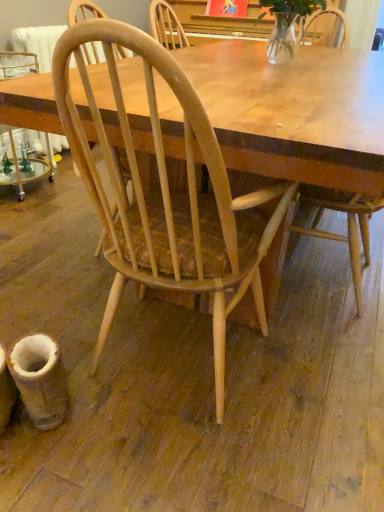
Find the location of a particular element. clear glass vase at upper center is located at coordinates (287, 24).

Describe the element at coordinates (347, 225) in the screenshot. The image size is (384, 512). I see `light wood chair at center, marked as the 2th chair in a left-to-right arrangement` at that location.

This screenshot has height=512, width=384. Identify the location of natural wood chair at center, which is the second chair from right to left. (167, 195).

Is natural wood chair at center, which is the second chair from right to left, thinner than clear glass vase at upper center?

In fact, natural wood chair at center, which is the second chair from right to left, might be wider than clear glass vase at upper center.

Looking at this image, which is nearer, (x=139, y=47) or (x=304, y=1)?

The point (x=139, y=47) is more forward.

Considering the relative sizes of natural wood chair at center, which is the second chair from right to left, and clear glass vase at upper center in the image provided, is natural wood chair at center, which is the second chair from right to left, shorter than clear glass vase at upper center?

No, natural wood chair at center, which is the second chair from right to left, is not shorter than clear glass vase at upper center.

From the image's perspective, which one is positioned higher, natural wood chair at center, acting as the 1th chair starting from the left, or clear glass vase at upper center?

clear glass vase at upper center, from the image's perspective.

Is point (253, 195) closer to viewer compared to point (314, 18)?

Yes, it is in front of point (314, 18).

Which object is more forward, natural wood chair at center, acting as the 1th chair starting from the left, or light wood chair at center, the first chair from the right?

Positioned in front is natural wood chair at center, acting as the 1th chair starting from the left.

From the image's perspective, which one is positioned higher, natural wood chair at center, which is the second chair from right to left, or light wood chair at center, the first chair from the right?

light wood chair at center, the first chair from the right, is shown above in the image.

How different are the orientations of natural wood chair at center, acting as the 1th chair starting from the left, and light wood chair at center, marked as the 2th chair in a left-to-right arrangement, in degrees?

natural wood chair at center, acting as the 1th chair starting from the left, and light wood chair at center, marked as the 2th chair in a left-to-right arrangement, are facing 90 degrees away from each other.

Consider the image. From a real-world perspective, is light wood chair at center, marked as the 2th chair in a left-to-right arrangement, located beneath clear glass vase at upper center?

Correct, in the physical world, light wood chair at center, marked as the 2th chair in a left-to-right arrangement, is lower than clear glass vase at upper center.

Can you tell me how much light wood chair at center, the first chair from the right, and clear glass vase at upper center differ in facing direction?

The facing directions of light wood chair at center, the first chair from the right, and clear glass vase at upper center are 91.4 degrees apart.

From the image's perspective, which is below, light wood chair at center, marked as the 2th chair in a left-to-right arrangement, or clear glass vase at upper center?

From the image's view, light wood chair at center, marked as the 2th chair in a left-to-right arrangement, is below.

Is clear glass vase at upper center at the left side of natural wood chair at center, acting as the 1th chair starting from the left?

No.

Would you say clear glass vase at upper center is a long distance from natural wood chair at center, which is the second chair from right to left?

They are positioned close to each other.

Considering the sizes of objects clear glass vase at upper center and natural wood chair at center, acting as the 1th chair starting from the left, in the image provided, who is bigger, clear glass vase at upper center or natural wood chair at center, acting as the 1th chair starting from the left,?

With larger size is natural wood chair at center, acting as the 1th chair starting from the left.

Could you measure the distance between clear glass vase at upper center and natural wood chair at center, which is the second chair from right to left?

clear glass vase at upper center and natural wood chair at center, which is the second chair from right to left, are 37.80 inches apart.

Is clear glass vase at upper center outside of light wood chair at center, marked as the 2th chair in a left-to-right arrangement?

Absolutely, clear glass vase at upper center is external to light wood chair at center, marked as the 2th chair in a left-to-right arrangement.

In order to click on the 1st chair located beneath the clear glass vase at upper center (from a real-world perspective) in this screenshot , I will do `click(347, 225)`.

In the image, is clear glass vase at upper center on the left side or the right side of light wood chair at center, the first chair from the right?

clear glass vase at upper center is to the left of light wood chair at center, the first chair from the right.

Which object is wider, clear glass vase at upper center or light wood chair at center, marked as the 2th chair in a left-to-right arrangement?

light wood chair at center, marked as the 2th chair in a left-to-right arrangement.

Who is bigger, light wood chair at center, the first chair from the right, or natural wood chair at center, which is the second chair from right to left?

natural wood chair at center, which is the second chair from right to left.

Considering the positions of objects light wood chair at center, the first chair from the right, and natural wood chair at center, acting as the 1th chair starting from the left, in the image provided, who is more to the left, light wood chair at center, the first chair from the right, or natural wood chair at center, acting as the 1th chair starting from the left,?

natural wood chair at center, acting as the 1th chair starting from the left.

Can you confirm if light wood chair at center, the first chair from the right, is wider than natural wood chair at center, acting as the 1th chair starting from the left?

No, light wood chair at center, the first chair from the right, is not wider than natural wood chair at center, acting as the 1th chair starting from the left.

Is light wood chair at center, marked as the 2th chair in a left-to-right arrangement, facing away from natural wood chair at center, which is the second chair from right to left?

light wood chair at center, marked as the 2th chair in a left-to-right arrangement, does not have its back to natural wood chair at center, which is the second chair from right to left.

The image size is (384, 512). Find the location of `plant above the natural wood chair at center, which is the second chair from right to left (from the image's perspective)`. plant above the natural wood chair at center, which is the second chair from right to left (from the image's perspective) is located at coordinates (287, 24).

The height and width of the screenshot is (512, 384). Identify the location of chair located on the left of light wood chair at center, the first chair from the right. (167, 195).

Looking at the image, which one is located closer to light wood chair at center, the first chair from the right, natural wood chair at center, which is the second chair from right to left, or clear glass vase at upper center?

natural wood chair at center, which is the second chair from right to left, is positioned closer to the anchor light wood chair at center, the first chair from the right.

Estimate the real-world distances between objects in this image. Which object is closer to natural wood chair at center, acting as the 1th chair starting from the left, clear glass vase at upper center or light wood chair at center, marked as the 2th chair in a left-to-right arrangement?

light wood chair at center, marked as the 2th chair in a left-to-right arrangement, lies closer to natural wood chair at center, acting as the 1th chair starting from the left, than the other object.

Looking at the image, which one is located further to natural wood chair at center, which is the second chair from right to left, light wood chair at center, the first chair from the right, or clear glass vase at upper center?

The object further to natural wood chair at center, which is the second chair from right to left, is clear glass vase at upper center.

From the picture: Based on their spatial positions, is light wood chair at center, the first chair from the right, or natural wood chair at center, acting as the 1th chair starting from the left, closer to clear glass vase at upper center?

light wood chair at center, the first chair from the right.

When comparing their distances from light wood chair at center, the first chair from the right, does clear glass vase at upper center or natural wood chair at center, acting as the 1th chair starting from the left, seem closer?

Based on the image, natural wood chair at center, acting as the 1th chair starting from the left, appears to be nearer to light wood chair at center, the first chair from the right.

From the image, which object appears to be nearer to clear glass vase at upper center, natural wood chair at center, acting as the 1th chair starting from the left, or light wood chair at center, marked as the 2th chair in a left-to-right arrangement?

Based on the image, light wood chair at center, marked as the 2th chair in a left-to-right arrangement, appears to be nearer to clear glass vase at upper center.

Where is `chair located between natural wood chair at center, which is the second chair from right to left, and clear glass vase at upper center in the depth direction`? chair located between natural wood chair at center, which is the second chair from right to left, and clear glass vase at upper center in the depth direction is located at coordinates (347, 225).